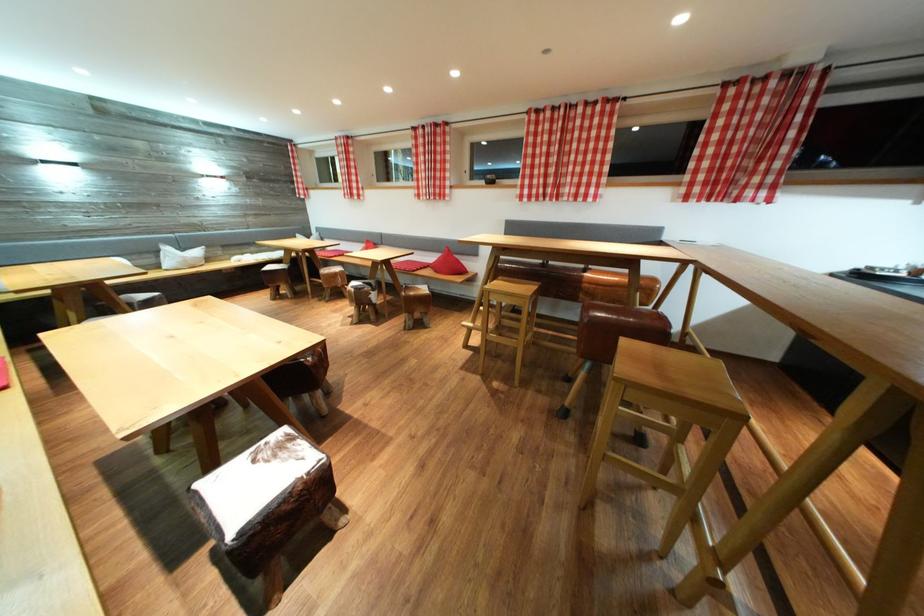
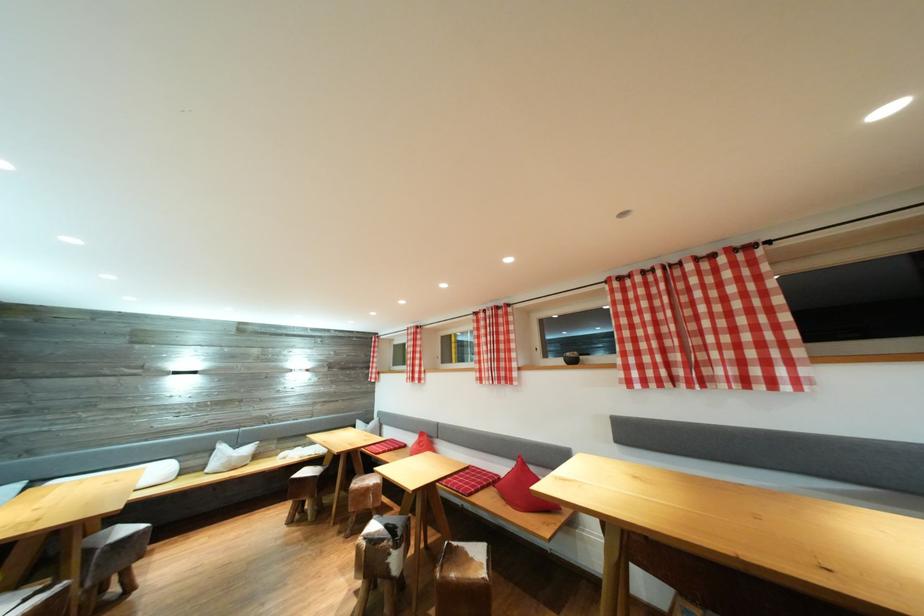
In the second image, find the point that corresponds to (548,111) in the first image.

(631, 278)